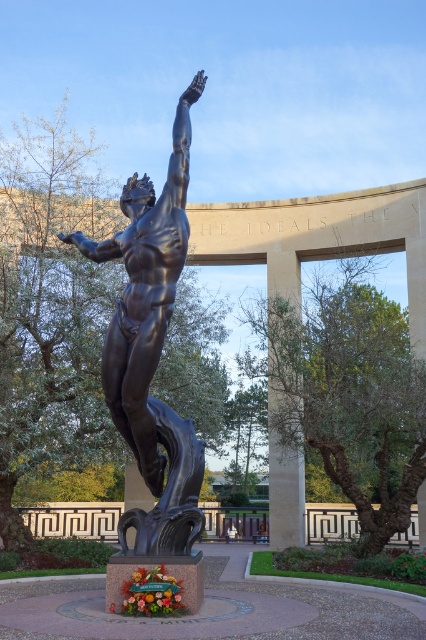
Question: Can you confirm if bronze statue at center is positioned to the right of smooth beige stone pillar at center?

Choices:
 (A) no
 (B) yes

Answer: (A)

Question: Where is bronze statue at center located in relation to smooth beige stone pillar at center in the image?

Choices:
 (A) right
 (B) left

Answer: (B)

Question: Is bronze statue at center closer to camera compared to smooth beige stone pillar at center?

Choices:
 (A) yes
 (B) no

Answer: (A)

Question: Among these objects, which one is farthest from the camera?

Choices:
 (A) smooth beige stone pillar at center
 (B) bronze statue at center

Answer: (A)

Question: Which object is closer to the camera taking this photo?

Choices:
 (A) smooth beige stone pillar at center
 (B) bronze statue at center

Answer: (B)